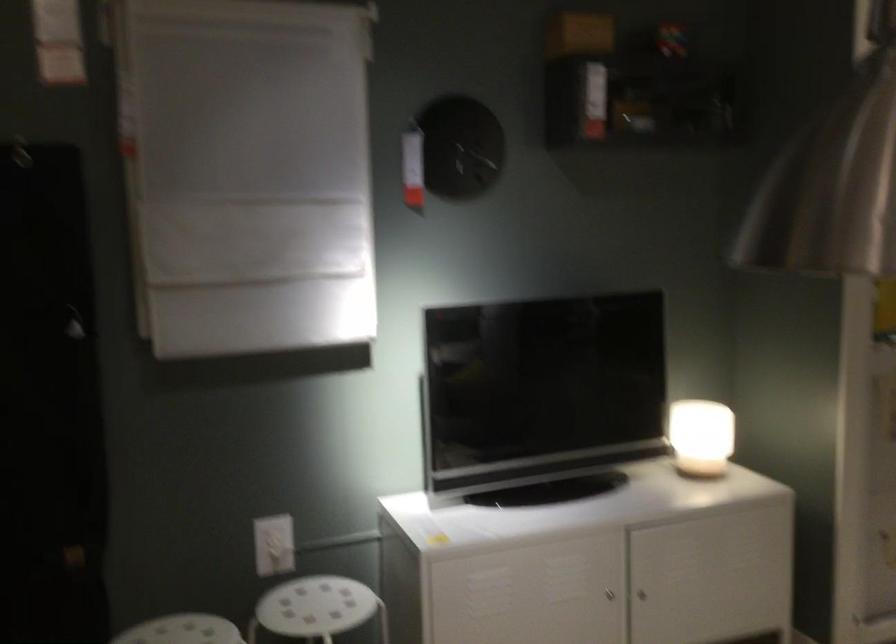
Where is `small glowing lamp`? The width and height of the screenshot is (896, 644). small glowing lamp is located at coordinates (701, 437).